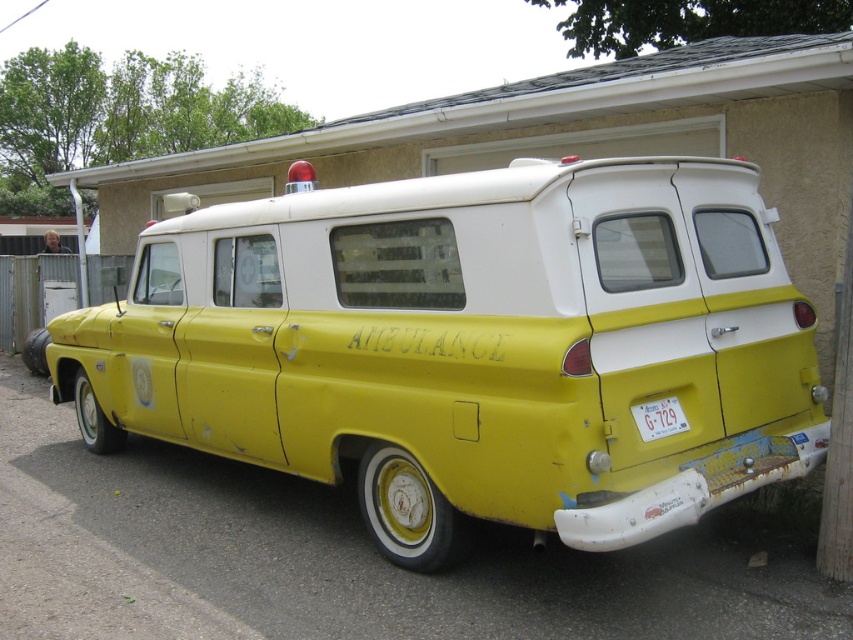
You are a delivery person trying to load a tall package onto a cart. You need to know if the yellow matte van at center and the white plastic license plate at rear will block the path. Which one is taller?

The yellow matte van at center is taller than the white plastic license plate at rear, so it will block the path more significantly.